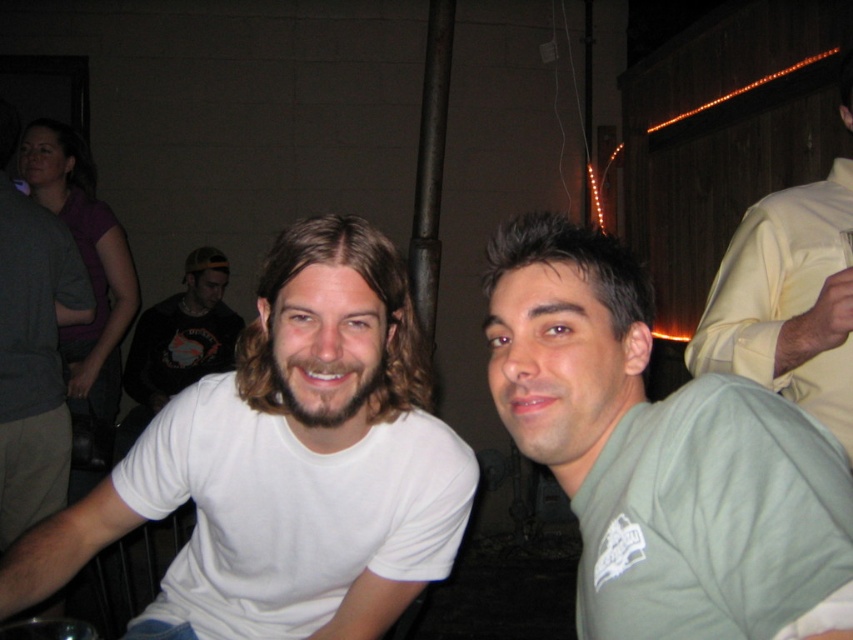
Is point (689, 612) in front of point (36, 348)?

Yes, point (689, 612) is in front of point (36, 348).

Is point (700, 570) closer to camera compared to point (12, 477)?

Yes, point (700, 570) is closer to viewer.

The width and height of the screenshot is (853, 640). I want to click on green cotton shirt at center, so click(x=659, y=452).

Which of these two, yellow smooth shirt at upper right or dark gray shirt at left, stands taller?

dark gray shirt at left is taller.

Find the location of a particular element. The height and width of the screenshot is (640, 853). yellow smooth shirt at upper right is located at coordinates (x=787, y=300).

What do you see at coordinates (787, 300) in the screenshot?
I see `yellow smooth shirt at upper right` at bounding box center [787, 300].

Find the location of a particular element. yellow smooth shirt at upper right is located at coordinates (787, 300).

Who is more forward, (38,406) or (207,312)?

Point (38,406) is in front.

Does point (49, 506) come in front of point (148, 381)?

Yes, point (49, 506) is in front of point (148, 381).

Where is `dark gray shirt at left`? This screenshot has height=640, width=853. dark gray shirt at left is located at coordinates (33, 356).

This screenshot has height=640, width=853. I want to click on dark gray shirt at left, so click(33, 356).